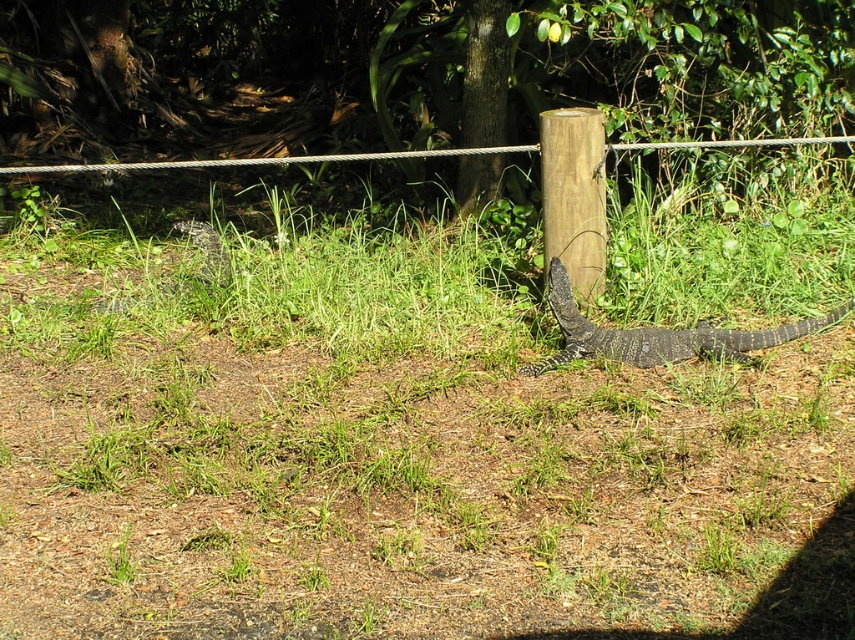
From the picture: Who is more forward, (599, 211) or (225, 280)?

Point (599, 211) is more forward.

Is wooden post at center below dark gray scaly lizard at center?

Incorrect, wooden post at center is not positioned below dark gray scaly lizard at center.

Who is more distant from viewer, (597, 144) or (193, 234)?

The point (193, 234) is more distant.

Where is `wooden post at center`? The width and height of the screenshot is (855, 640). wooden post at center is located at coordinates (575, 195).

Does wooden post at center have a larger size compared to dark gray scaly lizard at lower right?

No, wooden post at center is not bigger than dark gray scaly lizard at lower right.

Between wooden post at center and dark gray scaly lizard at lower right, which one appears on the left side from the viewer's perspective?

Positioned to the left is wooden post at center.

Between point (573, 134) and point (544, 368), which one is positioned behind?

The point (573, 134) is behind.

At what (x,y) coordinates should I click in order to perform the action: click on wooden post at center. Please return your answer as a coordinate pair (x, y). Looking at the image, I should click on (575, 195).

Is dark gray scaly lizard at lower right in front of dark gray scaly lizard at center?

Yes, dark gray scaly lizard at lower right is in front of dark gray scaly lizard at center.

Which is more to the right, dark gray scaly lizard at lower right or dark gray scaly lizard at center?

Positioned to the right is dark gray scaly lizard at lower right.

Is point (649, 349) positioned after point (203, 269)?

No, (649, 349) is closer to viewer.

The image size is (855, 640). I want to click on dark gray scaly lizard at lower right, so click(656, 333).